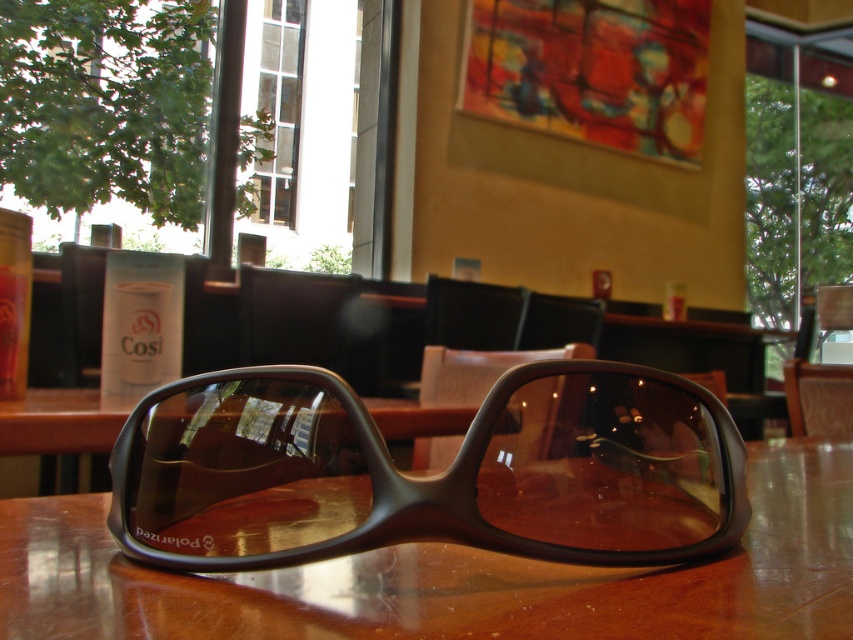
Between matte black sunglasses at center and brown polished wood table at center, which one is positioned lower?

brown polished wood table at center

Who is positioned more to the left, matte black sunglasses at center or brown polished wood table at center?

Positioned to the left is matte black sunglasses at center.

The image size is (853, 640). Identify the location of matte black sunglasses at center. (428, 477).